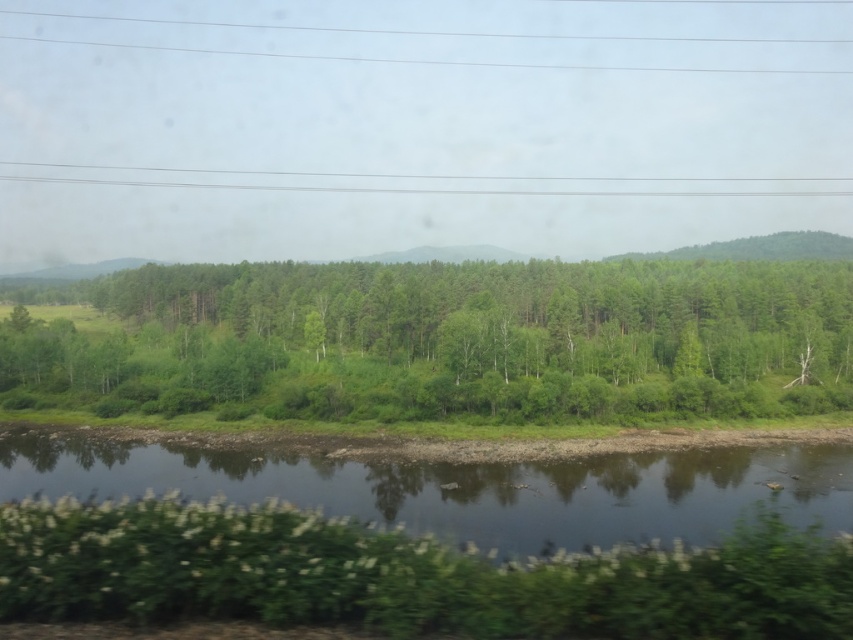
Is point (341, 300) positioned before point (62, 166)?

Yes, point (341, 300) is in front of point (62, 166).

Who is shorter, green leafy trees at center or clear plastic power lines at upper center?

clear plastic power lines at upper center is shorter.

Describe the element at coordinates (448, 339) in the screenshot. I see `green leafy trees at center` at that location.

I want to click on green leafy trees at center, so click(x=448, y=339).

Measure the distance between green leafy trees at center and green grassy river at lower center.

green leafy trees at center is 52.15 meters away from green grassy river at lower center.

Looking at this image, does green leafy trees at center have a greater width compared to green grassy river at lower center?

Yes, green leafy trees at center is wider than green grassy river at lower center.

Does point (791, 305) come farther from viewer compared to point (573, 465)?

Yes, it is.

The width and height of the screenshot is (853, 640). In order to click on green leafy trees at center in this screenshot , I will do `click(448, 339)`.

Identify the location of green grassy river at lower center. This screenshot has width=853, height=640. pos(468,488).

Is green grassy river at lower center positioned before clear plastic power lines at upper center?

That is True.

At what (x,y) coordinates should I click in order to perform the action: click on green grassy river at lower center. Please return your answer as a coordinate pair (x, y). Looking at the image, I should click on (468, 488).